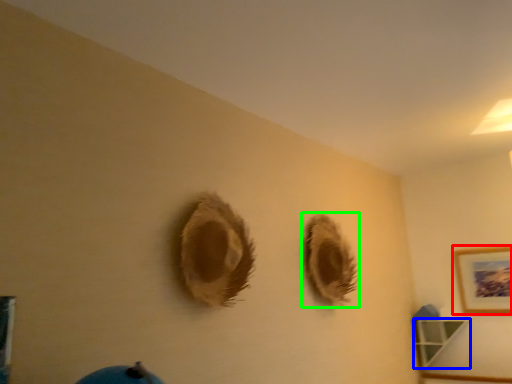
Question: Estimate the real-world distances between objects in this image. Which object is closer to picture frame (highlighted by a red box), shelf (highlighted by a blue box) or hole (highlighted by a green box)?

Choices:
 (A) shelf
 (B) hole

Answer: (A)